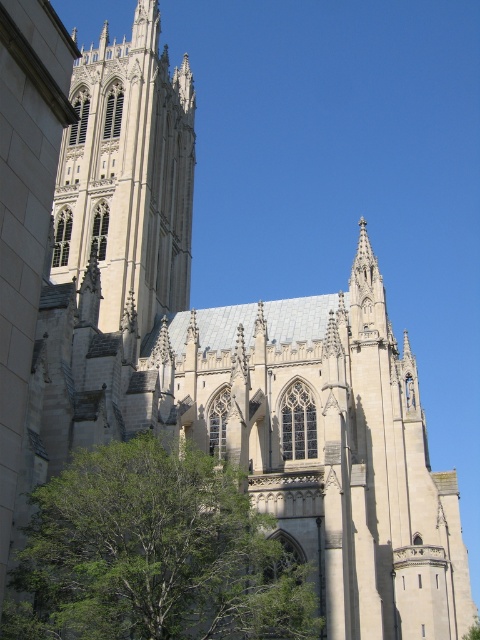
Question: Which object appears farthest from the camera in this image?

Choices:
 (A) green leafy tree at lower left
 (B) white stone tower at upper left

Answer: (B)

Question: Which point is closer to the camera?

Choices:
 (A) (113, 547)
 (B) (115, 257)

Answer: (A)

Question: Which point is farther to the camera?

Choices:
 (A) white stone tower at upper left
 (B) green leafy tree at lower left

Answer: (A)

Question: Does green leafy tree at lower left appear on the right side of white stone tower at upper left?

Choices:
 (A) no
 (B) yes

Answer: (B)

Question: Observing the image, what is the correct spatial positioning of green leafy tree at lower left in reference to white stone tower at upper left?

Choices:
 (A) left
 (B) right

Answer: (B)

Question: Is green leafy tree at lower left thinner than white stone tower at upper left?

Choices:
 (A) yes
 (B) no

Answer: (A)